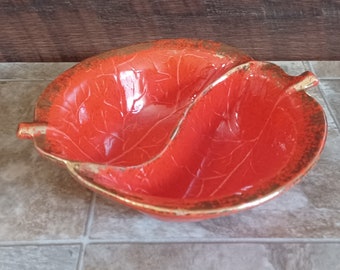
Where is `divider`? The height and width of the screenshot is (270, 340). divider is located at coordinates (146, 159).